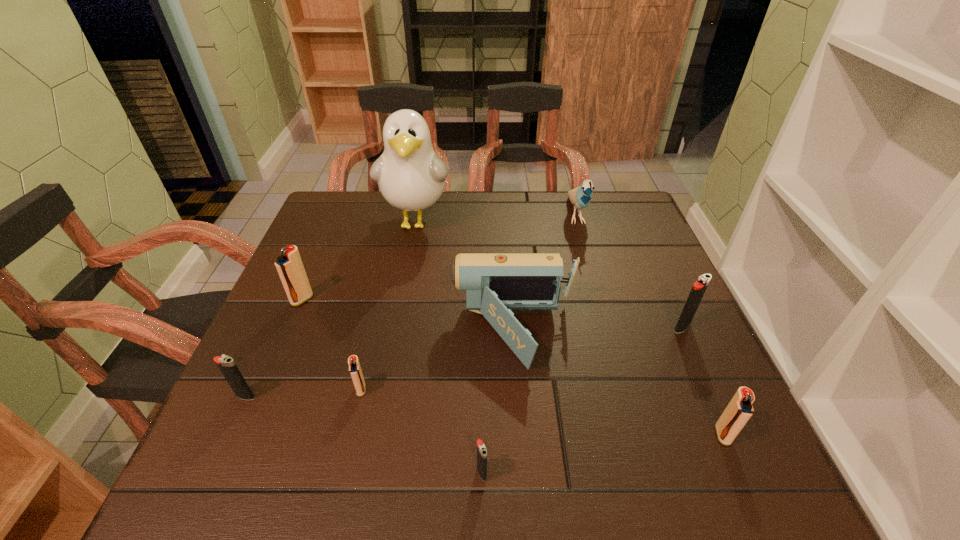
Identify the location of vacant area that lies between the biggest black igniter and the second nearest black igniter. (464, 362).

This screenshot has width=960, height=540. Identify the location of free space between the tallest object and the second nearest black igniter. (331, 309).

Find the location of a particular element. This screenshot has width=960, height=540. vacant point located between the tallest object and the biggest red igniter is located at coordinates point(359,261).

Identify the location of free spot between the blue bird and the rightmost red igniter. (649, 325).

At what (x,y) coordinates should I click in order to perform the action: click on free point between the nearest black igniter and the second farthest red igniter. Please return your answer as a coordinate pair (x, y). Image resolution: width=960 pixels, height=540 pixels. Looking at the image, I should click on (421, 431).

Image resolution: width=960 pixels, height=540 pixels. I want to click on object that can be found as the second closest to the bird, so click(411, 177).

Find the location of a particular element. The height and width of the screenshot is (540, 960). the seventh closest object to the fourth igniter from left to right is located at coordinates (411, 177).

Where is `igniter that is the second closest to the tallest object`? The height and width of the screenshot is (540, 960). igniter that is the second closest to the tallest object is located at coordinates (355, 371).

Locate an element on the screen. Image resolution: width=960 pixels, height=540 pixels. igniter that stands as the closest to the camcorder is located at coordinates (355, 371).

At what (x,y) coordinates should I click in order to perform the action: click on red igniter that stands as the second closest to the camcorder. Please return your answer as a coordinate pair (x, y). Looking at the image, I should click on (739, 410).